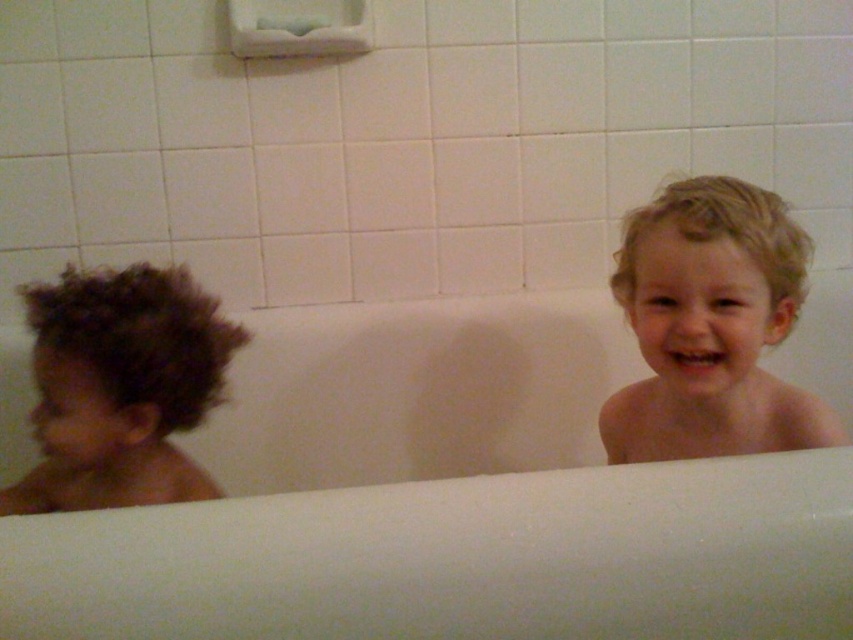
Does white smooth bathtub at center have a greater height compared to dark curly hair at left?

Indeed, white smooth bathtub at center has a greater height compared to dark curly hair at left.

Is white smooth bathtub at center positioned behind dark curly hair at left?

Yes, it is.

The image size is (853, 640). Find the location of `white smooth bathtub at center`. white smooth bathtub at center is located at coordinates (444, 500).

You are a GUI agent. You are given a task and a screenshot of the screen. Output one action in this format:
    pyautogui.click(x=<x>, y=<y>)
    Task: Click on the white smooth bathtub at center
    
    Given the screenshot: What is the action you would take?
    pyautogui.click(x=444, y=500)

Does blonde hair at right have a greater height compared to dark curly hair at left?

Correct, blonde hair at right is much taller as dark curly hair at left.

Does blonde hair at right appear under dark curly hair at left?

No, blonde hair at right is not below dark curly hair at left.

Does point (712, 298) come closer to viewer compared to point (117, 500)?

Yes, it is in front of point (117, 500).

Where is `blonde hair at right`? The width and height of the screenshot is (853, 640). blonde hair at right is located at coordinates (711, 326).

Is point (334, 369) in front of point (653, 348)?

No, it is behind (653, 348).

How distant is white smooth bathtub at center from blonde hair at right?

white smooth bathtub at center is 17.77 inches away from blonde hair at right.

Is point (83, 554) closer to viewer compared to point (660, 253)?

Yes, it is.

This screenshot has height=640, width=853. I want to click on white smooth bathtub at center, so click(x=444, y=500).